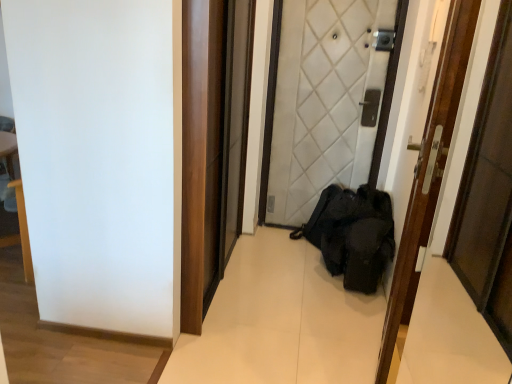
Find the location of `free space between white quilted fabric door at center, which is the second door from front to back, and wooden door at center, which is the second door in back-to-front order`. free space between white quilted fabric door at center, which is the second door from front to back, and wooden door at center, which is the second door in back-to-front order is located at coordinates (320, 289).